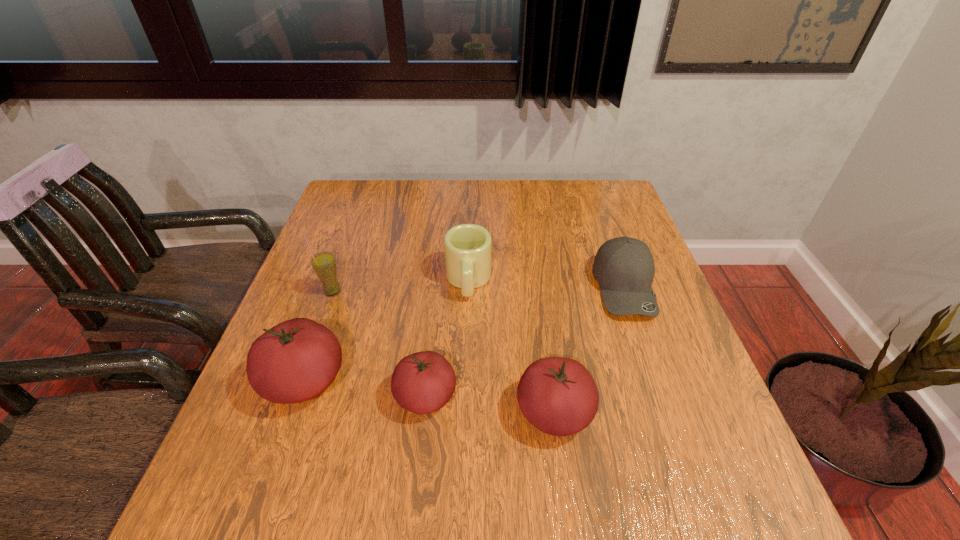
Please point a vacant point for placing a tomato on the right. Please provide its 2D coordinates. Your answer should be formatted as a tuple, i.e. [(x, y)], where the tuple contains the x and y coordinates of a point satisfying the conditions above.

[(691, 429)]